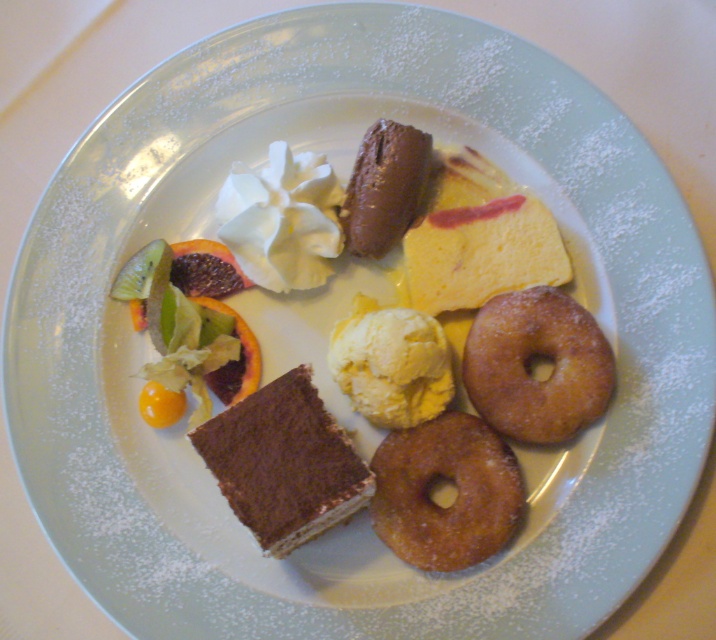
You are at a dessert buffet and want to choose between the yellow creamy ice cream at center and the chocolate smoothie at center. Which one has a bigger portion?

The yellow creamy ice cream at center is larger in size than the chocolate smoothie at center, so the yellow creamy ice cream at center has a bigger portion.

You are a dessert lover standing 1.2 meters away from the dessert plate. You want to reach the crispy golden donut at lower right without moving your feet. Can you just barely touch it with your outstretched hand?

The crispy golden donut at lower right is 1.14 meters away from the camera. Since you are standing 1.2 meters away, your outstretched hand can just barely reach it.

You are at a dessert buffet and want to take a photo of both the yellow creamy ice cream at center and the chocolate smoothie at center. Which one should you focus on first to ensure both are in the frame?

You should focus on the yellow creamy ice cream at center first since it is closer to the viewer, allowing the chocolate smoothie at center to stay in the frame as well.